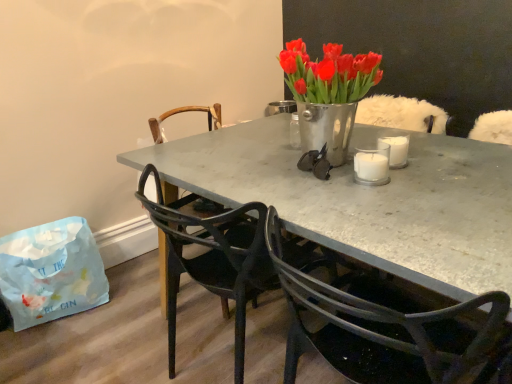
What do you see at coordinates (183, 112) in the screenshot? I see `wooden chair at center, the 3th chair positioned from the front` at bounding box center [183, 112].

What do you see at coordinates (214, 257) in the screenshot? I see `matte black chair at center, the first chair when ordered from front to back` at bounding box center [214, 257].

The height and width of the screenshot is (384, 512). Describe the element at coordinates (316, 163) in the screenshot. I see `metallic black glasses at center` at that location.

The height and width of the screenshot is (384, 512). Identify the location of white paper bag at lower left. (51, 272).

From a real-world perspective, which is physically below, metallic vase at center or matte black chair at center, the first chair when ordered from front to back?

matte black chair at center, the first chair when ordered from front to back.

Where is `houseplant that is above the matte black chair at center, which is the 3th chair from back to front (from a real-world perspective)`? houseplant that is above the matte black chair at center, which is the 3th chair from back to front (from a real-world perspective) is located at coordinates (328, 94).

Which is more to the right, matte black chair at center, the first chair when ordered from front to back, or matte black chair at center, which is the second chair in front-to-back order?

matte black chair at center, the first chair when ordered from front to back.

Which of these two, matte black chair at center, the first chair when ordered from front to back, or matte black chair at center, which is the second chair in front-to-back order, is wider?

With larger width is matte black chair at center, the first chair when ordered from front to back.

From the image's perspective, which is below, matte black chair at center, which is the 3th chair from back to front, or matte black chair at center, which is the second chair in front-to-back order?

matte black chair at center, which is the 3th chair from back to front, from the image's perspective.

Could you tell me if matte black chair at center, which is the 3th chair from back to front, is turned towards matte black chair at center, the second chair from the back?

No, matte black chair at center, which is the 3th chair from back to front, is not oriented towards matte black chair at center, the second chair from the back.

Based on their sizes in the image, would you say metallic black glasses at center is bigger or smaller than white paper bag at lower left?

Clearly, metallic black glasses at center is smaller in size than white paper bag at lower left.

Would you say metallic black glasses at center is a long distance from white paper bag at lower left?

Yes.

Based on the photo, does metallic black glasses at center lie behind white paper bag at lower left?

No, it is in front of white paper bag at lower left.

From the image's perspective, is metallic black glasses at center located above or below metallic gray table at center?

metallic black glasses at center is above metallic gray table at center.

Can you confirm if metallic black glasses at center is wider than metallic gray table at center?

In fact, metallic black glasses at center might be narrower than metallic gray table at center.

Is metallic black glasses at center facing towards metallic gray table at center?

No.

How many degrees apart are the facing directions of metallic black glasses at center and metallic gray table at center?

metallic black glasses at center and metallic gray table at center are facing 7.54 degrees away from each other.

Is metallic black glasses at center far away from matte black chair at center, which is the 3th chair from back to front?

They are positioned close to each other.

Can you confirm if metallic black glasses at center is shorter than matte black chair at center, which is the 3th chair from back to front?

Indeed, metallic black glasses at center has a lesser height compared to matte black chair at center, which is the 3th chair from back to front.

From the image's perspective, which is above, metallic black glasses at center or matte black chair at center, which is the 3th chair from back to front?

metallic black glasses at center appears higher in the image.

Is metallic black glasses at center positioned before matte black chair at center, the first chair when ordered from front to back?

No, metallic black glasses at center is further to the viewer.

Find the location of a particular element. handbag below the white glass candle at center (from a real-world perspective) is located at coordinates (51, 272).

Would you consider white glass candle at center to be distant from white paper bag at lower left?

Yes, white glass candle at center and white paper bag at lower left are quite far apart.

From a real-world perspective, does white glass candle at center sit lower than white paper bag at lower left?

No, from a real-world perspective, white glass candle at center is not beneath white paper bag at lower left.

From the picture: From a real-world perspective, is metallic vase at center positioned above or below white glass candle at center?

Clearly, from a real-world perspective, metallic vase at center is above white glass candle at center.

Is metallic vase at center taller than white glass candle at center?

Indeed, metallic vase at center has a greater height compared to white glass candle at center.

Looking at this image, which object is positioned more to the right, metallic vase at center or white glass candle at center?

white glass candle at center is more to the right.

Which is behind, point (317, 65) or point (355, 181)?

The point (355, 181) is more distant.

At what (x,y) coordinates should I click in order to perform the action: click on houseplant located on the right of matte black chair at center, the first chair when ordered from front to back. Please return your answer as a coordinate pair (x, y). This screenshot has width=512, height=384. Looking at the image, I should click on (328, 94).

At what (x,y) coordinates should I click in order to perform the action: click on chair in front of the matte black chair at center, which is the second chair in front-to-back order. Please return your answer as a coordinate pair (x, y). Looking at the image, I should click on (214, 257).

From the image, which object appears to be farther from white paper bag at lower left, metallic gray table at center or wooden chair at center, the 3th chair positioned from the front?

metallic gray table at center is further to white paper bag at lower left.

When comparing their distances from wooden chair at center, the 3th chair positioned from the front, does metallic gray table at center or matte black chair at center, the second chair from the back, seem closer?

The object closer to wooden chair at center, the 3th chair positioned from the front, is matte black chair at center, the second chair from the back.

Which object lies nearer to the anchor point matte black chair at center, the first chair when ordered from front to back, metallic black glasses at center or metallic vase at center?

metallic vase at center is closer to matte black chair at center, the first chair when ordered from front to back.

In the scene shown: When comparing their distances from wooden chair at center, the 3th chair positioned from the front, does white paper bag at lower left or metallic gray table at center seem further?

Based on the image, white paper bag at lower left appears to be further to wooden chair at center, the 3th chair positioned from the front.

When comparing their distances from metallic vase at center, does wooden chair at center, the 3th chair positioned from the front, or white glass candle at center seem further?

wooden chair at center, the 3th chair positioned from the front, is further to metallic vase at center.

Based on the photo, based on their spatial positions, is metallic gray table at center or white glass candle at center further from matte black chair at center, the second chair from the back?

Among the two, white glass candle at center is located further to matte black chair at center, the second chair from the back.

Which object lies nearer to the anchor point matte black chair at center, the first chair when ordered from front to back, wooden chair at center, the 3th chair positioned from the front, or white paper bag at lower left?

wooden chair at center, the 3th chair positioned from the front.

From the picture: From the image, which object appears to be nearer to metallic gray table at center, white glass candle at center or matte black chair at center, which is the 3th chair from back to front?

white glass candle at center.

Locate an element on the screen. The width and height of the screenshot is (512, 384). chair located between metallic gray table at center and metallic black glasses at center in the depth direction is located at coordinates (214, 257).

This screenshot has width=512, height=384. I want to click on chair between matte black chair at center, which is the 3th chair from back to front, and wooden chair at center, the 3th chair positioned from the front, along the z-axis, so click(184, 112).

In order to click on glasses positioned between metallic gray table at center and wooden chair at center, the 1th chair viewed from the back, from near to far in this screenshot , I will do `click(316, 163)`.

At what (x,y) coordinates should I click in order to perform the action: click on glasses between white paper bag at lower left and metallic gray table at center from left to right. Please return your answer as a coordinate pair (x, y). The width and height of the screenshot is (512, 384). Looking at the image, I should click on (316, 163).